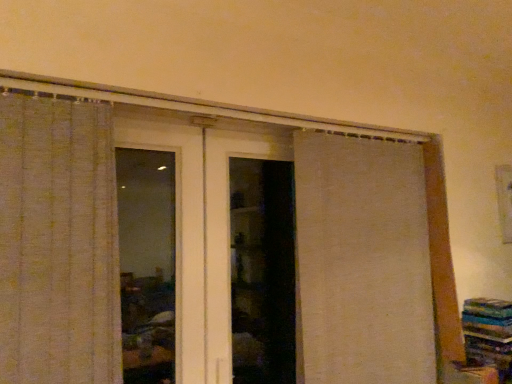
What do you see at coordinates (362, 261) in the screenshot?
I see `white textured curtain at center` at bounding box center [362, 261].

The image size is (512, 384). I want to click on white textured curtain at center, so click(362, 261).

Find the location of a particular element. The width and height of the screenshot is (512, 384). white textured curtain at center is located at coordinates (362, 261).